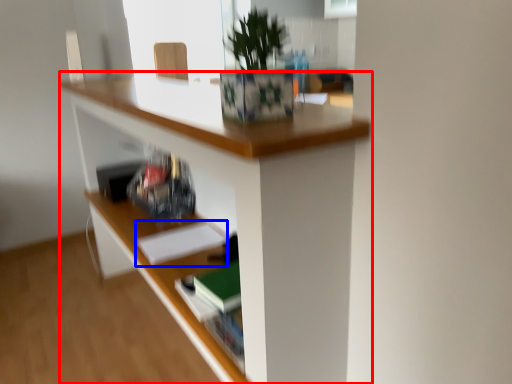
Question: Which object is closer to the camera taking this photo, desk (highlighted by a red box) or paperback book (highlighted by a blue box)?

Choices:
 (A) desk
 (B) paperback book

Answer: (A)